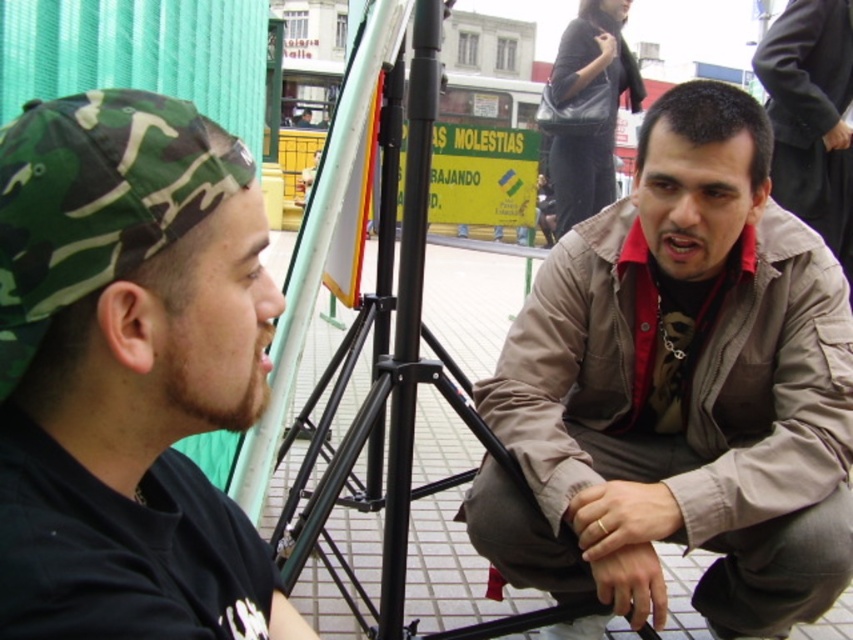
Who is positioned more to the left, camouflage fabric cap at left or brown leather jacket at center?

camouflage fabric cap at left is more to the left.

Is camouflage fabric cap at left further to camera compared to brown leather jacket at center?

That is False.

What are the coordinates of `camouflage fabric cap at left` in the screenshot? It's located at (129, 372).

I want to click on camouflage fabric cap at left, so click(x=129, y=372).

Can you confirm if brown matte jacket at center is bigger than brown leather jacket at center?

Yes, brown matte jacket at center is bigger than brown leather jacket at center.

From the picture: Which is more to the left, brown matte jacket at center or brown leather jacket at center?

brown matte jacket at center

Describe the element at coordinates (680, 388) in the screenshot. This screenshot has width=853, height=640. I see `brown matte jacket at center` at that location.

This screenshot has height=640, width=853. What are the coordinates of `brown matte jacket at center` in the screenshot? It's located at (680, 388).

Is point (668, 490) more distant than point (140, 314)?

Yes, it is behind point (140, 314).

Does point (749, 115) lie in front of point (144, 589)?

No, it is behind (144, 589).

Does point (813, 605) lie behind point (35, 401)?

Yes, it is.

The image size is (853, 640). Find the location of `brown matte jacket at center`. brown matte jacket at center is located at coordinates [680, 388].